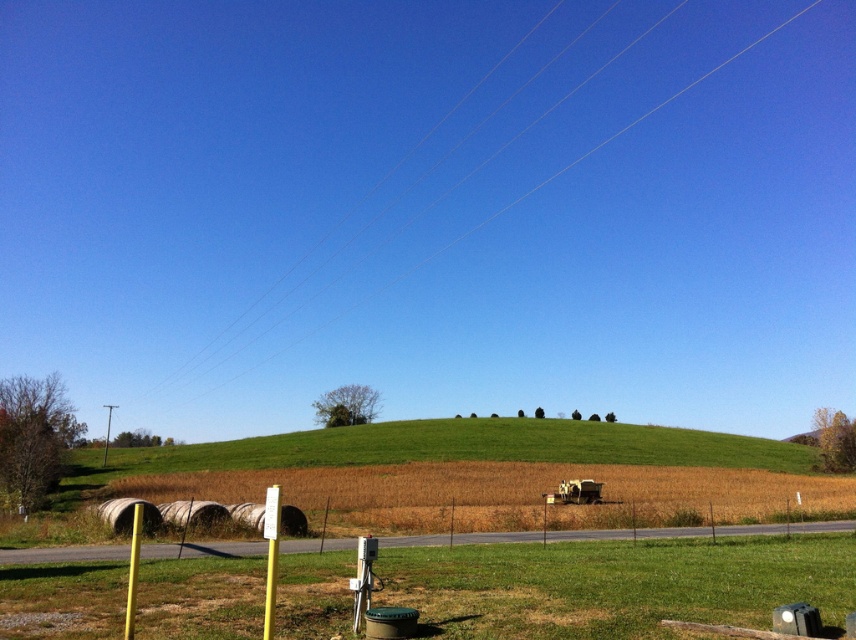
Question: Where is green grassy field at lower center located in relation to green grassy hill at center in the image?

Choices:
 (A) above
 (B) below

Answer: (A)

Question: Which object is the closest to the green grassy field at lower center?

Choices:
 (A) green grassy hill at center
 (B) clear blue sky at upper center

Answer: (A)

Question: Which object is farther from the camera taking this photo?

Choices:
 (A) green grassy field at lower center
 (B) clear blue sky at upper center
 (C) green grassy hill at center
 (D) yellow matte pole at lower left

Answer: (B)

Question: Which point is closer to the camera?

Choices:
 (A) (135, 602)
 (B) (34, 595)

Answer: (A)

Question: Does clear blue sky at upper center appear on the left side of yellow matte pole at lower left?

Choices:
 (A) yes
 (B) no

Answer: (B)

Question: Where is green grassy hill at center located in relation to clear blue sky at upper center in the image?

Choices:
 (A) below
 (B) above

Answer: (A)